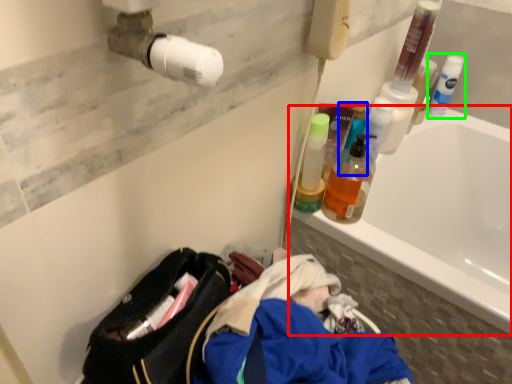
Question: Estimate the real-world distances between objects in this image. Which object is closer to bathtub (highlighted by a red box), cleaning product (highlighted by a blue box) or cleaning product (highlighted by a green box)?

Choices:
 (A) cleaning product
 (B) cleaning product

Answer: (B)